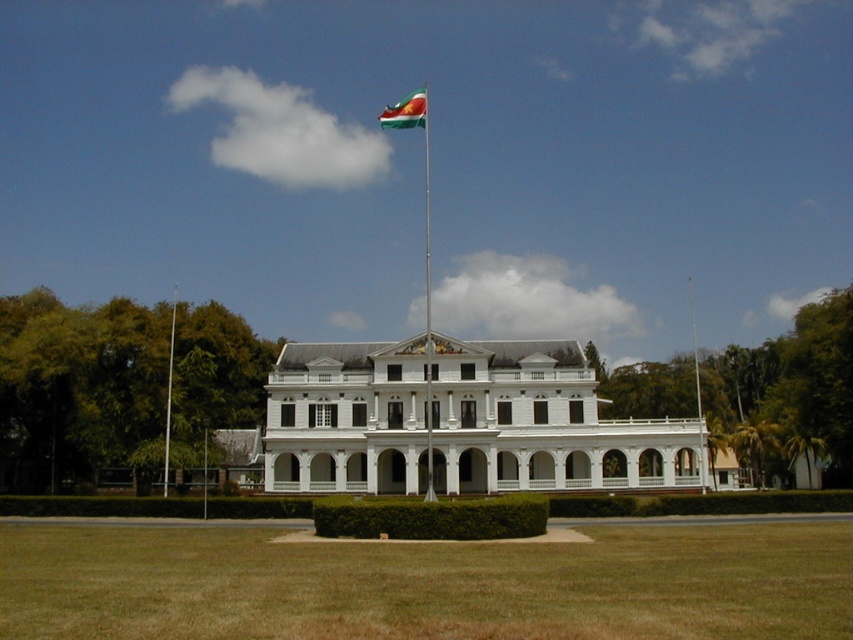
Question: Which is nearer to the green grass at lower center?

Choices:
 (A) polished plastic flag at upper center
 (B) metallic flag pole at center

Answer: (B)

Question: Does green grass at lower center come in front of metallic flag pole at center?

Choices:
 (A) yes
 (B) no

Answer: (A)

Question: Does green grass at lower center have a lesser width compared to metallic flag pole at center?

Choices:
 (A) no
 (B) yes

Answer: (A)

Question: Which point appears farthest from the camera in this image?

Choices:
 (A) (386, 113)
 (B) (297, 490)

Answer: (A)

Question: Among these points, which one is farthest from the camera?

Choices:
 (A) (389, 124)
 (B) (167, 454)
 (C) (51, 577)
 (D) (703, 451)

Answer: (A)

Question: Observing the image, what is the correct spatial positioning of polished plastic flag at upper center in reference to white metallic flag pole at center?

Choices:
 (A) left
 (B) right

Answer: (A)